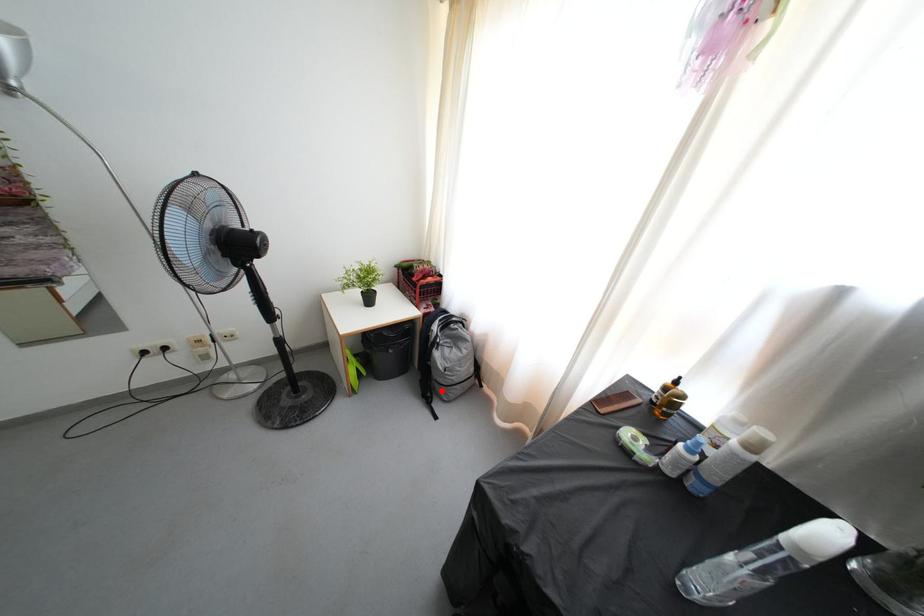
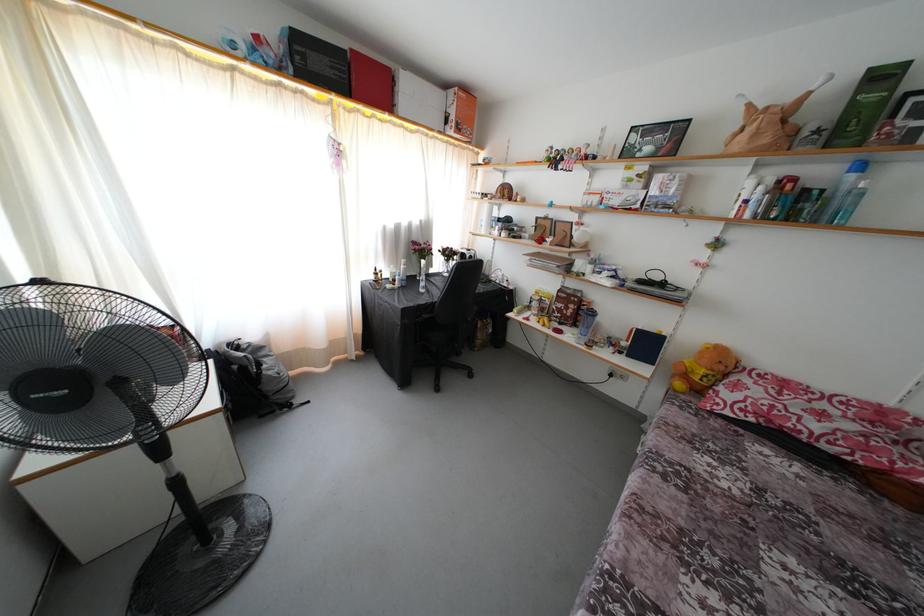
Where in the second image is the point corresponding to the highlighted location from the first image?

(281, 403)